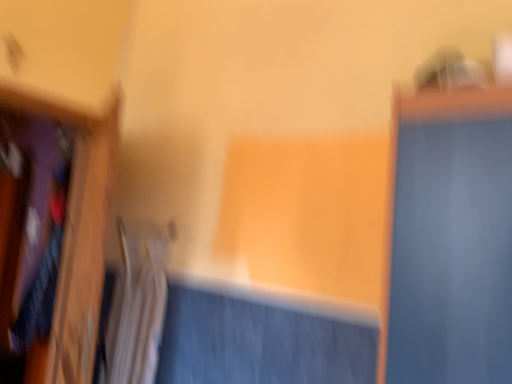
Question: Considering the positions of white fabric radiator at lower left and velvet-like fabric shirt at left in the image, is white fabric radiator at lower left taller or shorter than velvet-like fabric shirt at left?

Choices:
 (A) short
 (B) tall

Answer: (A)

Question: In terms of size, does white fabric radiator at lower left appear bigger or smaller than velvet-like fabric shirt at left?

Choices:
 (A) big
 (B) small

Answer: (B)

Question: Which object is the farthest from the white fabric radiator at lower left?

Choices:
 (A) velvet-like fabric shirt at left
 (B) wooden frame at left

Answer: (A)

Question: Based on their relative distances, which object is nearer to the velvet-like fabric shirt at left?

Choices:
 (A) wooden frame at left
 (B) white fabric radiator at lower left

Answer: (A)